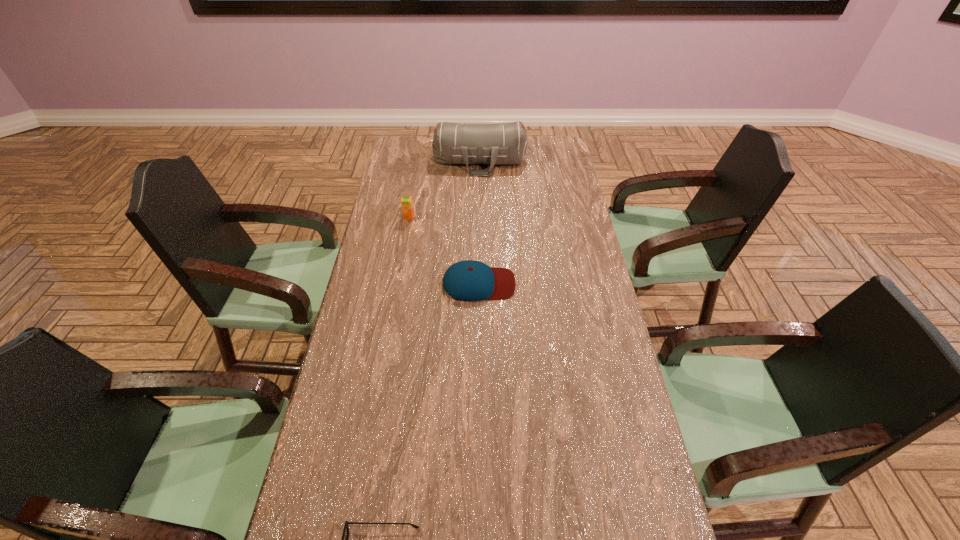
Find the location of a particular element. The width and height of the screenshot is (960, 540). vacant area between the farthest object and the orange juice is located at coordinates (444, 189).

Identify the location of object that stands as the second closest to the nearest object. The height and width of the screenshot is (540, 960). (406, 202).

Identify which object is located as the third nearest to the third tallest object. Please provide its 2D coordinates. Your answer should be formatted as a tuple, i.e. [(x, y)], where the tuple contains the x and y coordinates of a point satisfying the conditions above.

[(346, 527)]

You are a GUI agent. You are given a task and a screenshot of the screen. Output one action in this format:
    pyautogui.click(x=<x>, y=<y>)
    Task: Click on the vacant region that satisfies the following two spatial constraints: 1. on the back side of the orange juice; 2. on the right side of the duffel bag
    Image resolution: width=960 pixels, height=540 pixels.
    Given the screenshot: What is the action you would take?
    pyautogui.click(x=419, y=161)